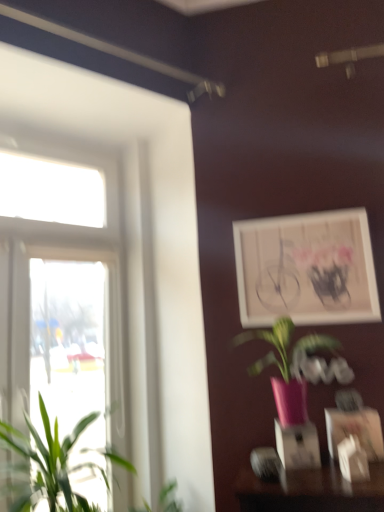
Question: From a real-world perspective, is white matte picture frame at upper right, the 1th picture frame in the back-to-front sequence, on pink matte vase at center, marked as the 2th houseplant in a left-to-right arrangement?

Choices:
 (A) yes
 (B) no

Answer: (A)

Question: Is pink matte vase at center, the first houseplant in the right-to-left sequence, located within white matte picture frame at upper right, which is the 2th picture frame in front-to-back order?

Choices:
 (A) yes
 (B) no

Answer: (B)

Question: Does white matte picture frame at upper right, the 1th picture frame in the back-to-front sequence, have a greater width compared to pink matte vase at center, the first houseplant in the right-to-left sequence?

Choices:
 (A) yes
 (B) no

Answer: (B)

Question: Is white matte picture frame at upper right, the first picture frame positioned from the top, to the right of pink matte vase at center, marked as the 2th houseplant in a left-to-right arrangement, from the viewer's perspective?

Choices:
 (A) no
 (B) yes

Answer: (B)

Question: Does white matte picture frame at upper right, which is the 2th picture frame in front-to-back order, have a greater height compared to pink matte vase at center, marked as the 2th houseplant in a left-to-right arrangement?

Choices:
 (A) yes
 (B) no

Answer: (A)

Question: Based on their positions, is clear glass window at left located to the left or right of matte white picture frame at lower right, placed as the first picture frame when sorted from bottom to top?

Choices:
 (A) right
 (B) left

Answer: (B)

Question: In terms of size, does clear glass window at left appear bigger or smaller than matte white picture frame at lower right, which is counted as the 2th picture frame, starting from the back?

Choices:
 (A) small
 (B) big

Answer: (B)

Question: Choose the correct answer: Is clear glass window at left inside matte white picture frame at lower right, marked as the second picture frame in a top-to-bottom arrangement, or outside it?

Choices:
 (A) outside
 (B) inside

Answer: (A)

Question: Does point (6, 309) appear closer or farther from the camera than point (332, 430)?

Choices:
 (A) farther
 (B) closer

Answer: (A)

Question: From a real-world perspective, is pink matte vase at center, the first houseplant in the right-to-left sequence, positioned above or below clear glass window at left?

Choices:
 (A) below
 (B) above

Answer: (A)

Question: Considering the positions of pink matte vase at center, marked as the 2th houseplant in a left-to-right arrangement, and clear glass window at left in the image, is pink matte vase at center, marked as the 2th houseplant in a left-to-right arrangement, taller or shorter than clear glass window at left?

Choices:
 (A) short
 (B) tall

Answer: (A)

Question: Based on their sizes in the image, would you say pink matte vase at center, marked as the 2th houseplant in a left-to-right arrangement, is bigger or smaller than clear glass window at left?

Choices:
 (A) small
 (B) big

Answer: (A)

Question: Which is correct: pink matte vase at center, the first houseplant in the right-to-left sequence, is inside clear glass window at left, or outside of it?

Choices:
 (A) inside
 (B) outside

Answer: (B)

Question: From the image's perspective, is matte white picture frame at lower right, marked as the second picture frame in a top-to-bottom arrangement, positioned above or below white matte picture frame at upper right, the 1th picture frame in the back-to-front sequence?

Choices:
 (A) above
 (B) below

Answer: (B)

Question: Is matte white picture frame at lower right, marked as the second picture frame in a top-to-bottom arrangement, wider or thinner than white matte picture frame at upper right, which is the 2th picture frame in front-to-back order?

Choices:
 (A) wide
 (B) thin

Answer: (A)